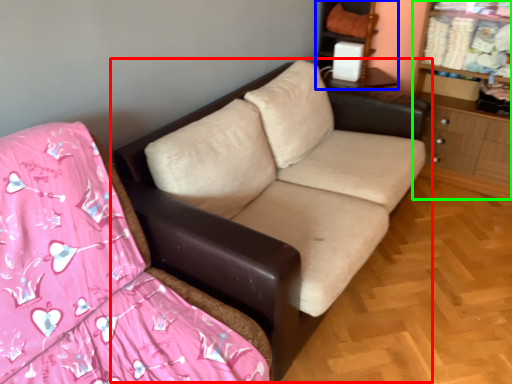
Question: Based on their relative distances, which object is nearer to studio couch (highlighted by a red box)? Choose from entertainment center (highlighted by a blue box) and dresser (highlighted by a green box).

Choices:
 (A) entertainment center
 (B) dresser

Answer: (B)